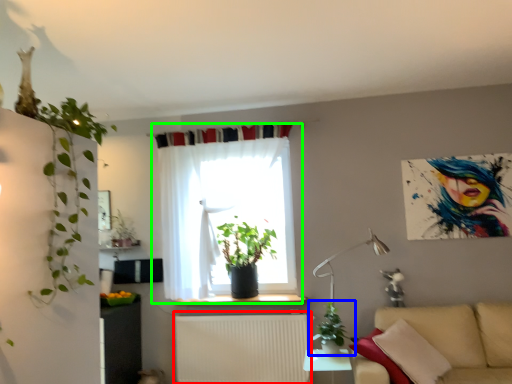
Question: Based on their relative distances, which object is farther from radiator (highlighted by a red box)? Choose from houseplant (highlighted by a blue box) and curtain (highlighted by a green box).

Choices:
 (A) houseplant
 (B) curtain

Answer: (A)